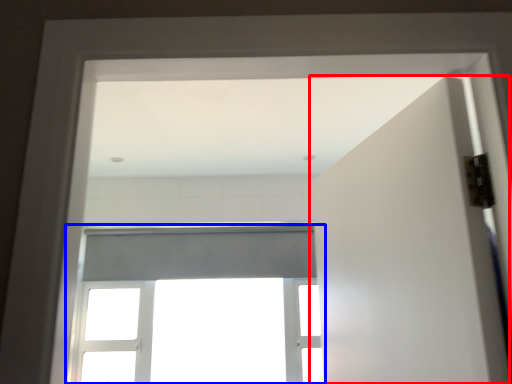
Question: Which point is further to the camera, door (highlighted by a red box) or window (highlighted by a blue box)?

Choices:
 (A) door
 (B) window

Answer: (B)